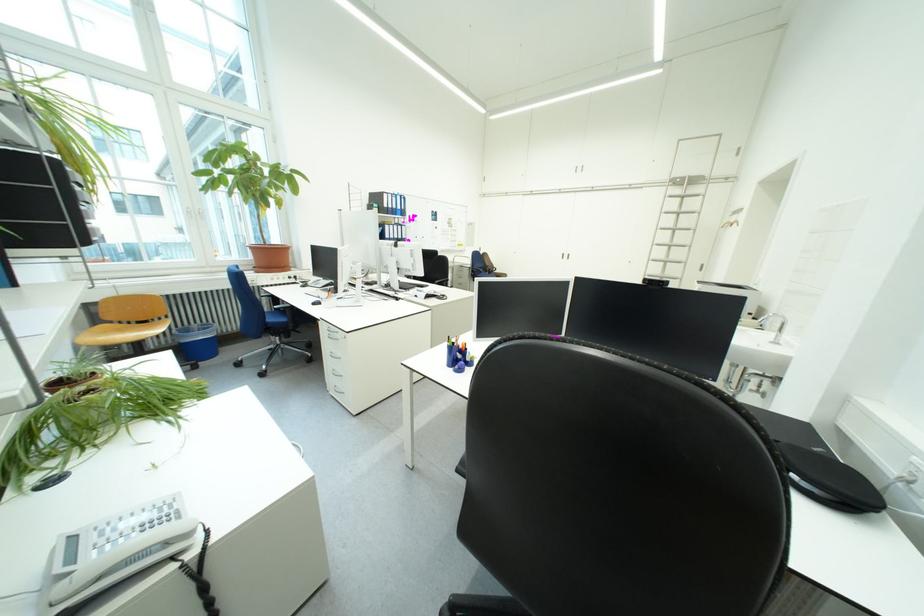
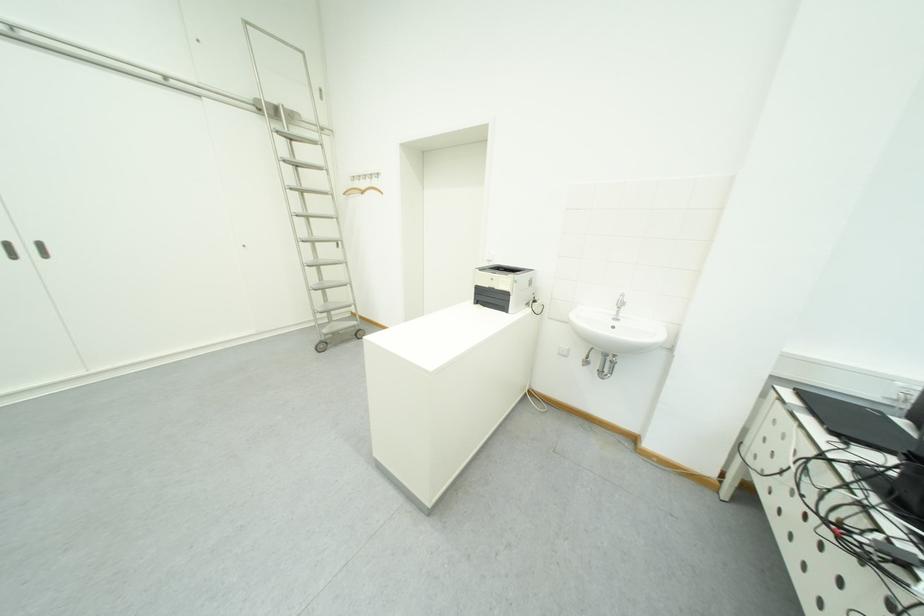
In the second image, find the point that corresponds to point 577,257 in the first image.

(40, 252)